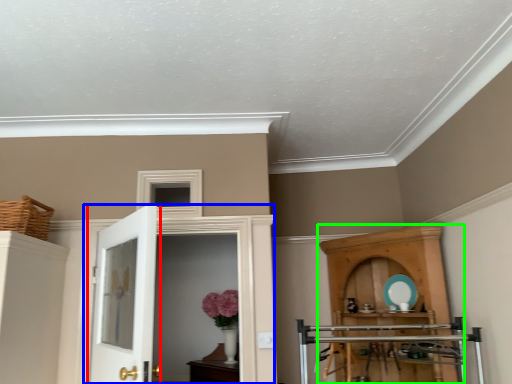
Question: Which is farther away from door (highlighted by a red box)? door (highlighted by a blue box) or cupboard (highlighted by a green box)?

Choices:
 (A) door
 (B) cupboard

Answer: (B)